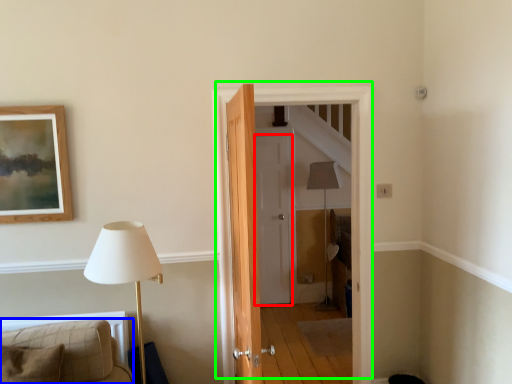
Question: Estimate the real-world distances between objects in this image. Which object is closer to door (highlighted by a red box), furniture (highlighted by a blue box) or door (highlighted by a green box)?

Choices:
 (A) furniture
 (B) door

Answer: (B)